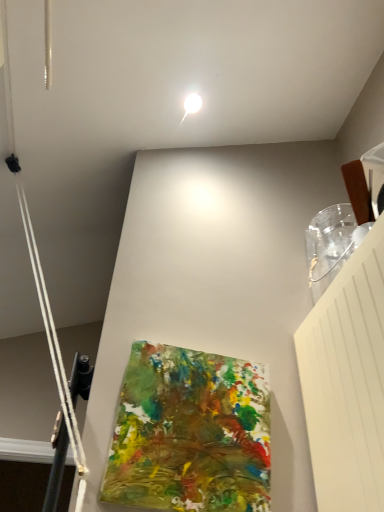
Question: Is white glossy droplight at upper center smaller than abstract painting at center?

Choices:
 (A) yes
 (B) no

Answer: (A)

Question: Is white glossy droplight at upper center wider than abstract painting at center?

Choices:
 (A) yes
 (B) no

Answer: (A)

Question: From a real-world perspective, is white glossy droplight at upper center beneath abstract painting at center?

Choices:
 (A) no
 (B) yes

Answer: (A)

Question: Considering the relative positions of white glossy droplight at upper center and abstract painting at center in the image provided, is white glossy droplight at upper center behind abstract painting at center?

Choices:
 (A) no
 (B) yes

Answer: (B)

Question: Can you confirm if white glossy droplight at upper center is positioned to the left of abstract painting at center?

Choices:
 (A) no
 (B) yes

Answer: (B)

Question: Considering the relative positions of white glossy droplight at upper center and abstract painting at center in the image provided, is white glossy droplight at upper center to the right of abstract painting at center from the viewer's perspective?

Choices:
 (A) no
 (B) yes

Answer: (A)

Question: Is abstract painting at center to the left of white glossy droplight at upper center from the viewer's perspective?

Choices:
 (A) yes
 (B) no

Answer: (B)

Question: Would you say abstract painting at center is outside white glossy droplight at upper center?

Choices:
 (A) no
 (B) yes

Answer: (B)

Question: Is there a large distance between abstract painting at center and white glossy droplight at upper center?

Choices:
 (A) no
 (B) yes

Answer: (B)

Question: Does abstract painting at center have a lesser width compared to white glossy droplight at upper center?

Choices:
 (A) no
 (B) yes

Answer: (B)

Question: Is abstract painting at center next to white glossy droplight at upper center and touching it?

Choices:
 (A) no
 (B) yes

Answer: (A)

Question: From the image's perspective, is abstract painting at center located beneath white glossy droplight at upper center?

Choices:
 (A) yes
 (B) no

Answer: (A)

Question: Relative to abstract painting at center, is white glossy droplight at upper center in front or behind?

Choices:
 (A) behind
 (B) front

Answer: (A)